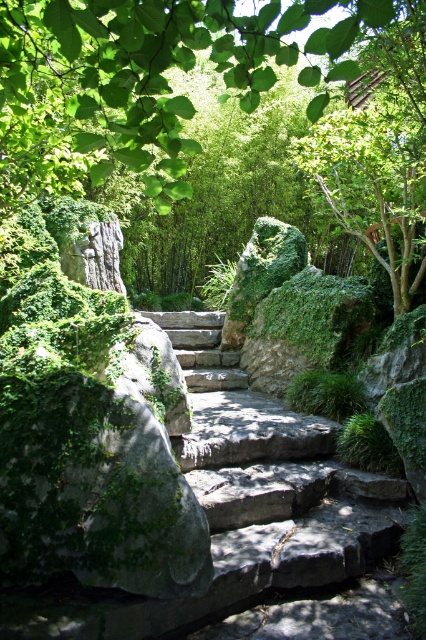
Question: Is green leafy tree at upper center positioned before dark gray stone stairs at center?

Choices:
 (A) no
 (B) yes

Answer: (B)

Question: Which of the following is the farthest from the observer?

Choices:
 (A) dark gray stone stairs at center
 (B) green leafy tree at upper center

Answer: (A)

Question: From the image, what is the correct spatial relationship of green leafy tree at upper center in relation to dark gray stone stairs at center?

Choices:
 (A) above
 (B) below

Answer: (A)

Question: From the image, what is the correct spatial relationship of green leafy tree at upper center in relation to dark gray stone stairs at center?

Choices:
 (A) below
 (B) above

Answer: (B)